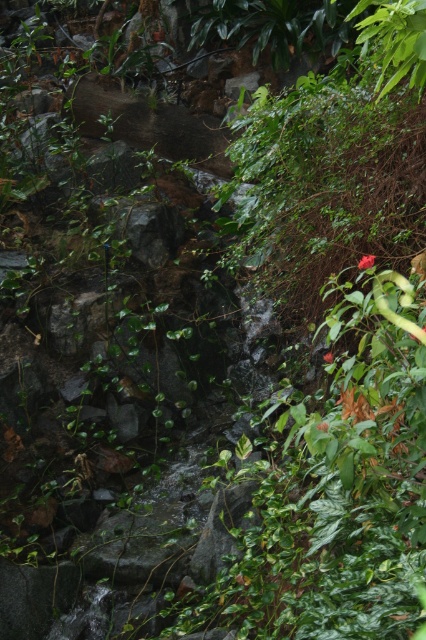
Which is behind, point (368, 264) or point (324, 356)?

Positioned behind is point (324, 356).

This screenshot has width=426, height=640. Describe the element at coordinates (367, 260) in the screenshot. I see `green matte flower at center` at that location.

Locate an element on the screen. green matte flower at center is located at coordinates (367, 260).

Locate an element on the screen. green matte flower at center is located at coordinates coord(367,260).